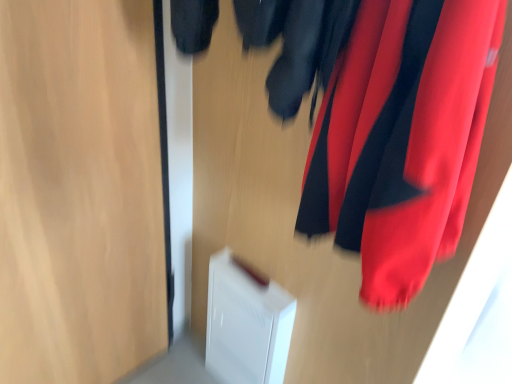
Question: Should I look upward or downward to see satin red curtain at upper right?

Choices:
 (A) up
 (B) down

Answer: (A)

Question: Is satin red curtain at upper right looking in the opposite direction of transparent glass door at left?

Choices:
 (A) no
 (B) yes

Answer: (A)

Question: Considering the relative sizes of satin red curtain at upper right and transparent glass door at left in the image provided, is satin red curtain at upper right shorter than transparent glass door at left?

Choices:
 (A) yes
 (B) no

Answer: (A)

Question: Is satin red curtain at upper right positioned in front of transparent glass door at left?

Choices:
 (A) no
 (B) yes

Answer: (B)

Question: Is satin red curtain at upper right placed right next to transparent glass door at left?

Choices:
 (A) yes
 (B) no

Answer: (B)

Question: From the image's perspective, is satin red curtain at upper right over transparent glass door at left?

Choices:
 (A) no
 (B) yes

Answer: (B)

Question: Is satin red curtain at upper right aimed at transparent glass door at left?

Choices:
 (A) no
 (B) yes

Answer: (A)

Question: From the image's perspective, is transparent glass door at left located above satin red curtain at upper right?

Choices:
 (A) no
 (B) yes

Answer: (A)

Question: Can you confirm if transparent glass door at left is positioned to the right of satin red curtain at upper right?

Choices:
 (A) yes
 (B) no

Answer: (B)

Question: Can you confirm if transparent glass door at left is shorter than satin red curtain at upper right?

Choices:
 (A) yes
 (B) no

Answer: (B)

Question: Is satin red curtain at upper right at the back of transparent glass door at left?

Choices:
 (A) no
 (B) yes

Answer: (A)

Question: Is transparent glass door at left to the left of satin red curtain at upper right from the viewer's perspective?

Choices:
 (A) yes
 (B) no

Answer: (A)

Question: Is transparent glass door at left aimed at satin red curtain at upper right?

Choices:
 (A) no
 (B) yes

Answer: (B)

Question: Would you say transparent glass door at left is to the left or to the right of satin red curtain at upper right in the picture?

Choices:
 (A) right
 (B) left

Answer: (B)